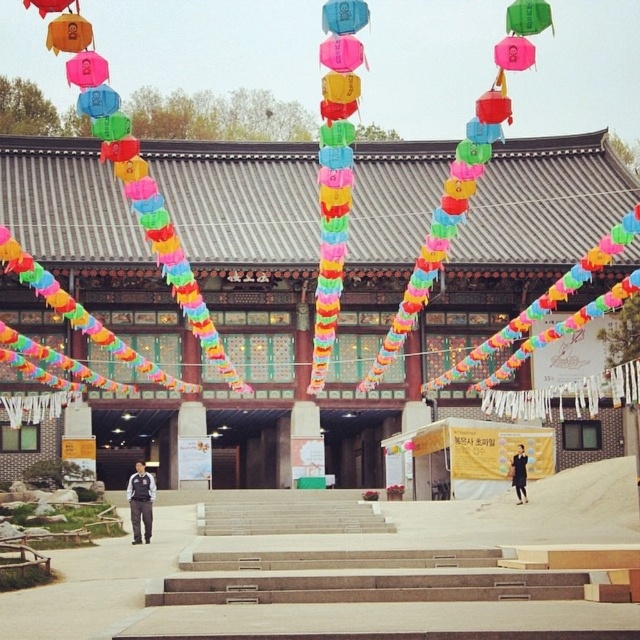
The width and height of the screenshot is (640, 640). Describe the element at coordinates (513, 52) in the screenshot. I see `pink paper lantern at upper center` at that location.

Measure the distance between pink paper lantern at upper center and dark blue fabric coat at lower right.

pink paper lantern at upper center is 38.70 meters away from dark blue fabric coat at lower right.

Between point (497, 65) and point (516, 467), which one is positioned in front?

Point (516, 467) is more forward.

Locate an element on the screen. The image size is (640, 640). pink paper lantern at upper center is located at coordinates (513, 52).

Is dark blue uniform at center positioned at the back of dark blue fabric coat at lower right?

No, it is not.

Who is positioned more to the right, dark blue uniform at center or dark blue fabric coat at lower right?

Positioned to the right is dark blue fabric coat at lower right.

Describe the element at coordinates (140, 500) in the screenshot. I see `dark blue uniform at center` at that location.

Locate an element on the screen. Image resolution: width=640 pixels, height=640 pixels. dark blue uniform at center is located at coordinates (140, 500).

Is dark blue uniform at center smaller than pink paper lantern at upper center?

Correct, dark blue uniform at center occupies less space than pink paper lantern at upper center.

Does dark blue uniform at center have a greater width compared to pink paper lantern at upper center?

In fact, dark blue uniform at center might be narrower than pink paper lantern at upper center.

Which is behind, point (132, 515) or point (515, 70)?

Positioned behind is point (132, 515).

Locate an element on the screen. The width and height of the screenshot is (640, 640). dark blue uniform at center is located at coordinates (140, 500).